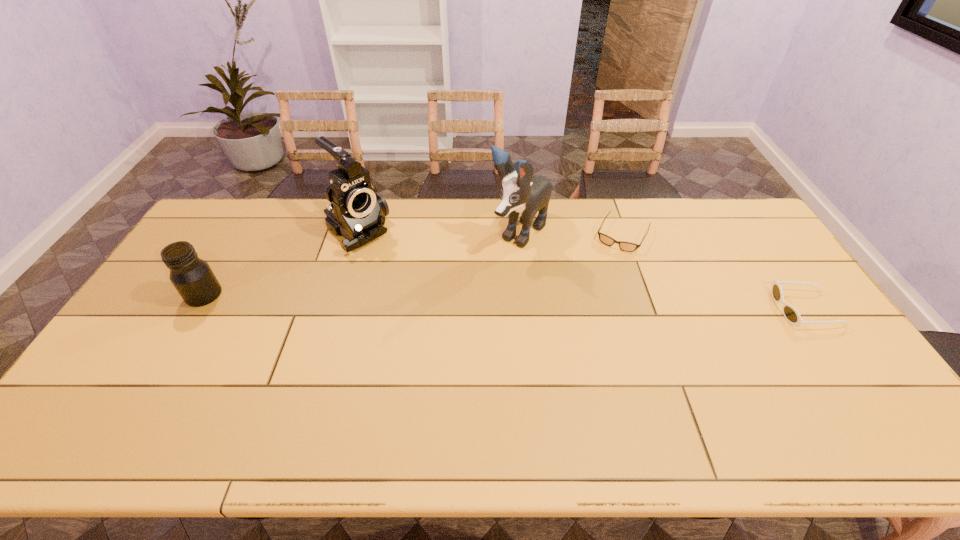
This screenshot has width=960, height=540. In the image, there is a desktop. Identify the location of free space at the left edge. (165, 300).

The image size is (960, 540). I want to click on vacant space at the right edge, so click(736, 259).

Where is `blank space at the near left corner of the desktop`? The height and width of the screenshot is (540, 960). blank space at the near left corner of the desktop is located at coordinates (140, 401).

Locate an element on the screen. This screenshot has height=540, width=960. vacant position at the far right corner of the desktop is located at coordinates (701, 204).

The width and height of the screenshot is (960, 540). What are the coordinates of `vacant space in between the tallest object and the fourth tallest object` in the screenshot? It's located at (662, 271).

The width and height of the screenshot is (960, 540). I want to click on free spot between the tallest object and the right sunglasses, so click(662, 271).

In order to click on free space between the left sunglasses and the second tallest object in this screenshot , I will do `click(490, 233)`.

Locate an element on the screen. Image resolution: width=960 pixels, height=540 pixels. vacant area between the camcorder and the jar is located at coordinates (280, 264).

Image resolution: width=960 pixels, height=540 pixels. In order to click on free space between the shorter sunglasses and the taller sunglasses in this screenshot , I will do `click(714, 272)`.

This screenshot has height=540, width=960. I want to click on vacant area that lies between the left sunglasses and the third shortest object, so click(414, 265).